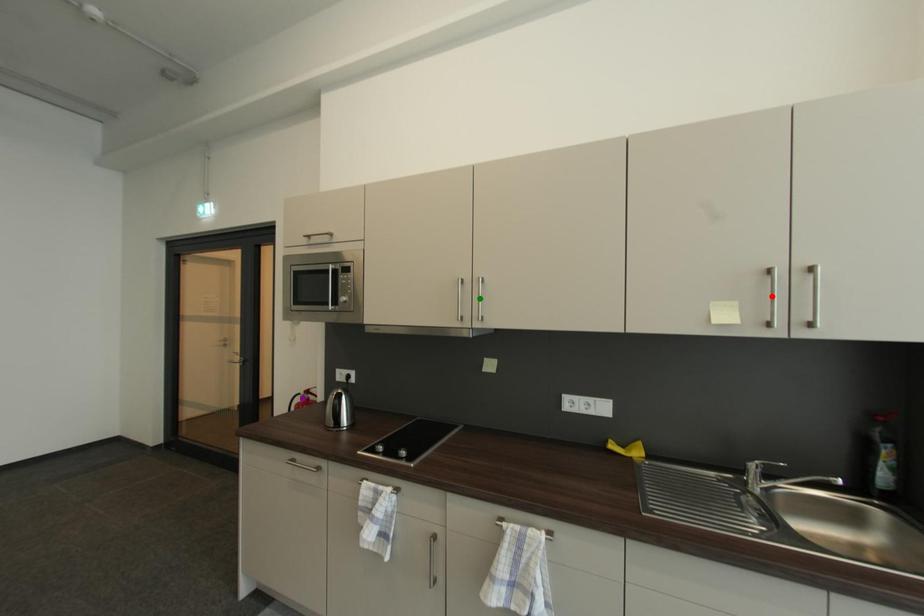
Order these from nearest to farthest:
1. red point
2. green point
3. purple point

1. red point
2. green point
3. purple point